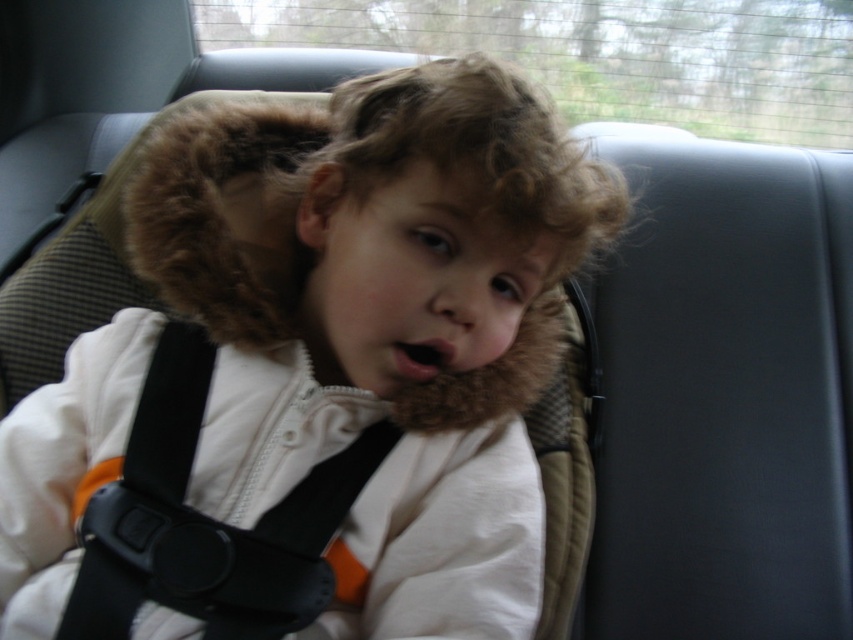
Question: Does white fleece jacket at center appear on the right side of black plastic seatbelt at center?

Choices:
 (A) no
 (B) yes

Answer: (B)

Question: Which point is closer to the camera taking this photo?

Choices:
 (A) [445, 220]
 (B) [105, 515]

Answer: (A)

Question: Does white fleece jacket at center appear on the left side of black plastic seatbelt at center?

Choices:
 (A) no
 (B) yes

Answer: (A)

Question: Which object appears closest to the camera in this image?

Choices:
 (A) white fleece jacket at center
 (B) black plastic seatbelt at center

Answer: (A)

Question: Where is white fleece jacket at center located in relation to black plastic seatbelt at center in the image?

Choices:
 (A) right
 (B) left

Answer: (A)